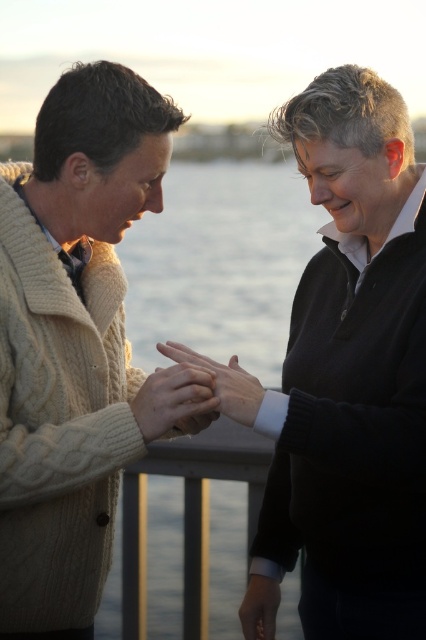
Is matte beige hand at center bigger than matte black hand at lower center?

Yes.

Is matte beige hand at center shorter than matte black hand at lower center?

No, matte beige hand at center is not shorter than matte black hand at lower center.

Between point (241, 394) and point (247, 600), which one is positioned behind?

Positioned behind is point (247, 600).

The image size is (426, 640). Identify the location of matte beige hand at center. (224, 381).

Can you confirm if matte beige sweater at center is taller than matte beige hand at center?

No, matte beige sweater at center is not taller than matte beige hand at center.

Can you confirm if matte beige sweater at center is thinner than matte beige hand at center?

Answer: Correct, matte beige sweater at center's width is less than matte beige hand at center's.

Is point (150, 380) closer to viewer compared to point (232, 408)?

No, it is not.

This screenshot has width=426, height=640. I want to click on matte beige sweater at center, so click(175, 401).

Between point (147, 406) and point (256, 605), which one is positioned behind?

Positioned behind is point (256, 605).

Can you confirm if matte beige sweater at center is bigger than matte black hand at lower center?

Correct, matte beige sweater at center is larger in size than matte black hand at lower center.

Between point (154, 394) and point (241, 608), which one is positioned in front?

Point (154, 394)

The image size is (426, 640). I want to click on matte beige sweater at center, so click(175, 401).